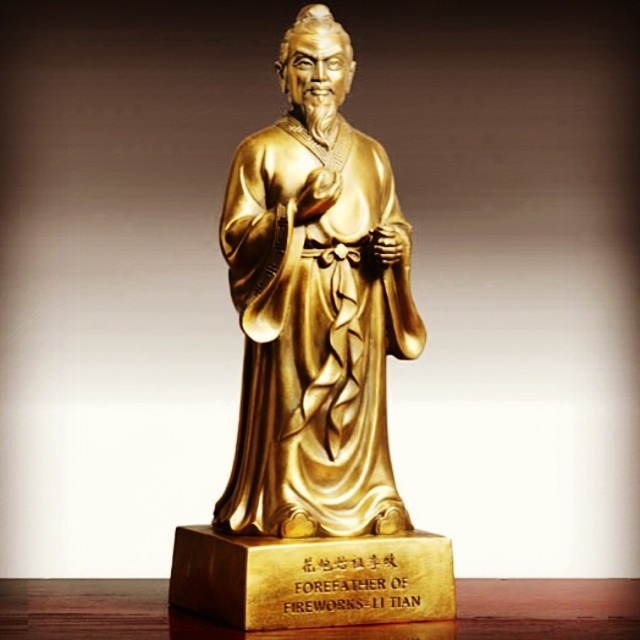
You are a visitor at a cultural exhibition and see the gold polished statue at center and the wooden table at lower center. Which object is taller?

The gold polished statue at center is taller than the wooden table at lower center according to the description.

Consider the image. You are a tourist standing in front of the statue and want to take a photo. The statue is located at point 0.480, 0.494. If your camera has a standard lens with a field of view that can capture a square area of 0.5x0.5 meters centered at your current position, will the gold polished statue at center be fully visible in your photo?

The gold polished statue at center is positioned at point (316, 307). Since the camera captures a 0.5x0.5 meter square centered at your position, the statue is within the frame as its coordinates are near the center. Therefore, it will be fully visible.

You are a photographer standing at a certain distance from the gold polished statue at center. You want to capture a full view of the statue in your photo. The recommended minimum distance for a full view is 4 feet. Can you take the photo from your current position?

The gold polished statue at center is 4.20 feet away from the camera, which is just beyond the recommended minimum distance of 4 feet. Therefore, you can take the photo from your current position to capture a full view of the statue.